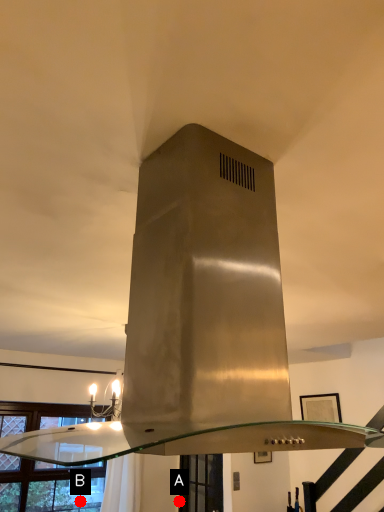
Question: Two points are circled on the image, labeled by A and B beside each circle. Which point is closer to the camera?

Choices:
 (A) A is closer
 (B) B is closer

Answer: (B)